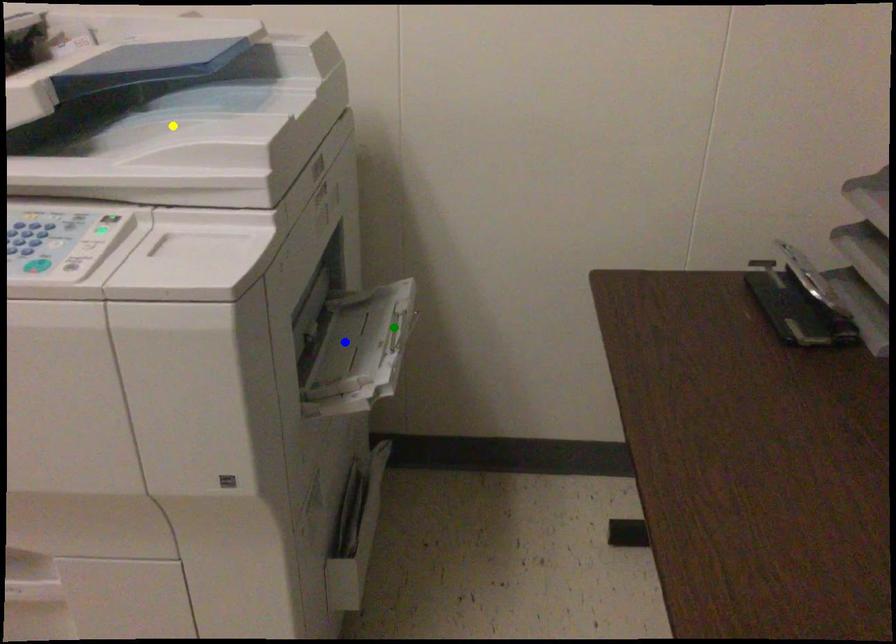
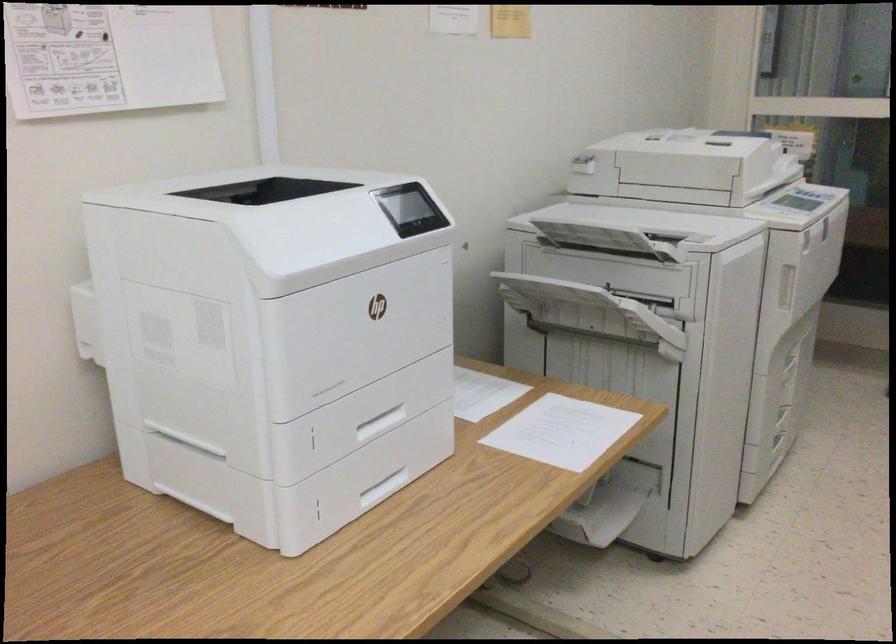
I am providing you with two images of the same scene from different viewpoints. Three points are marked in image1. Which point corresponds to a part or object that is occluded in image2?In image1, three points are marked. Which of them correspond to a part or object that is occluded in image2?Among the three points shown in image1, which one corresponds to a part or object that is no longer visible due to occlusion in image2?

blue point, yellow point, green point